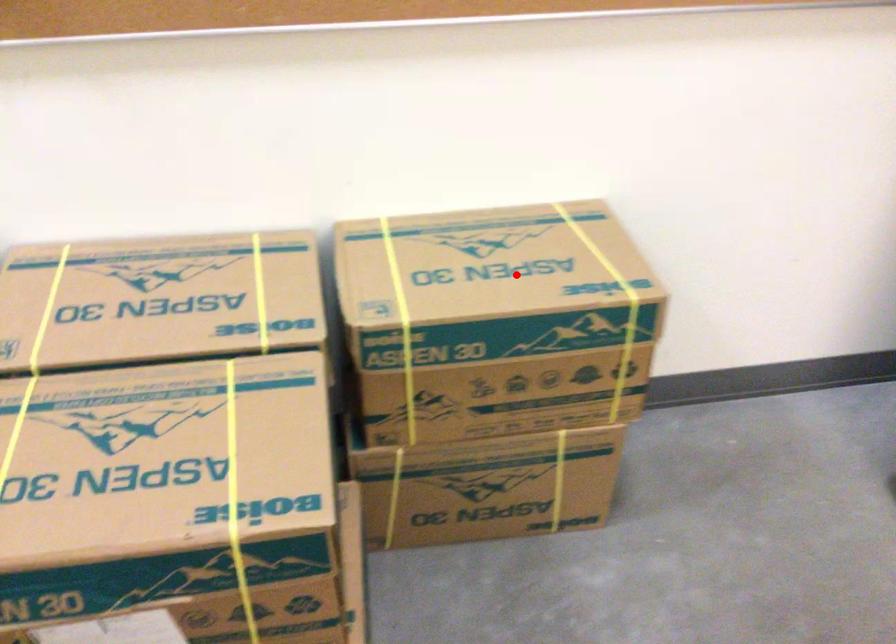
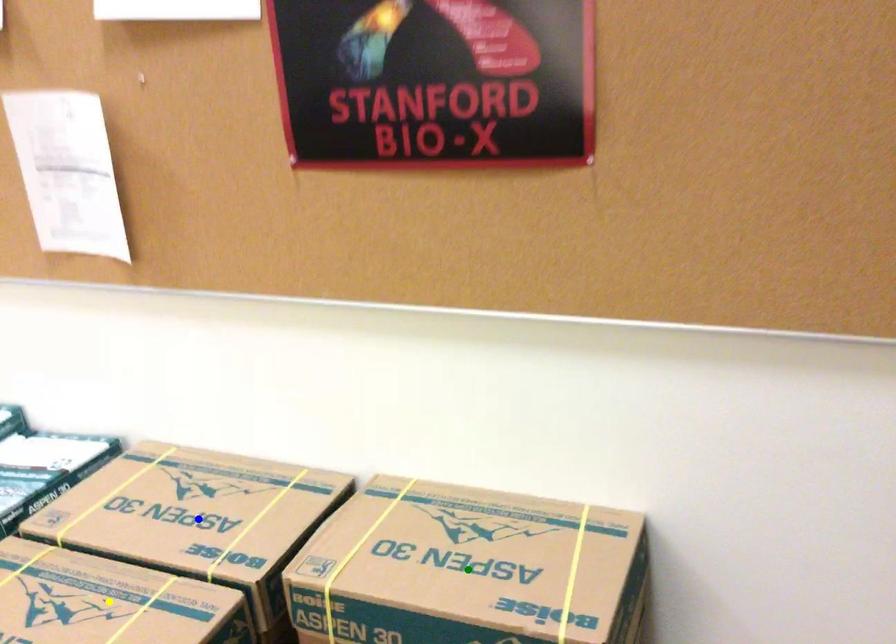
Question: I am providing you with two images of the same scene from different viewpoints. A red point is marked on the first image. You are given multiple points on the second image. Which point in image 2 is actually the same real-world point as the red point in image 1?

Choices:
 (A) blue point
 (B) yellow point
 (C) green point

Answer: (C)